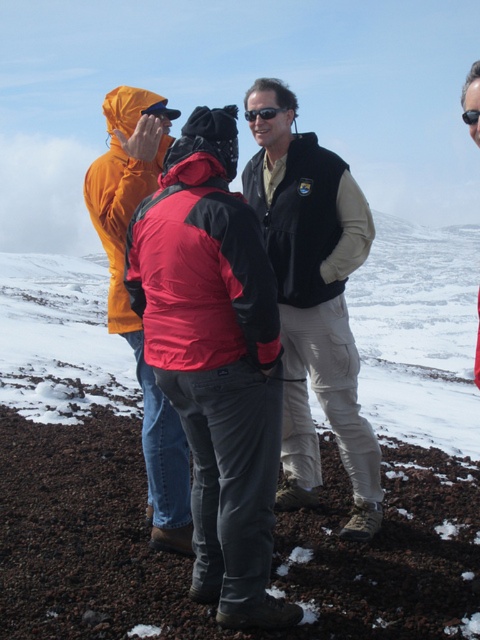
Question: Is white powdery snow at center below white fluffy cloud at upper left?

Choices:
 (A) no
 (B) yes

Answer: (B)

Question: Does matte orange jacket at left have a smaller size compared to white fluffy cloud at upper left?

Choices:
 (A) no
 (B) yes

Answer: (B)

Question: Is matte orange jacket at left in front of white fluffy cloud at upper left?

Choices:
 (A) no
 (B) yes

Answer: (B)

Question: Which of these objects is positioned farthest from the black plastic goggles at upper right?

Choices:
 (A) white powdery snow at center
 (B) velvet black vest at center
 (C) matte orange jacket at left

Answer: (A)

Question: Based on their relative distances, which object is nearer to the matte orange jacket at left?

Choices:
 (A) black plastic goggles at upper right
 (B) white powdery snow at center
 (C) white fluffy cloud at upper left
 (D) velvet black vest at center

Answer: (D)

Question: Which point appears closest to the camera in this image?

Choices:
 (A) (48, 198)
 (B) (333, 228)
 (C) (156, 161)
 (D) (467, 113)

Answer: (D)